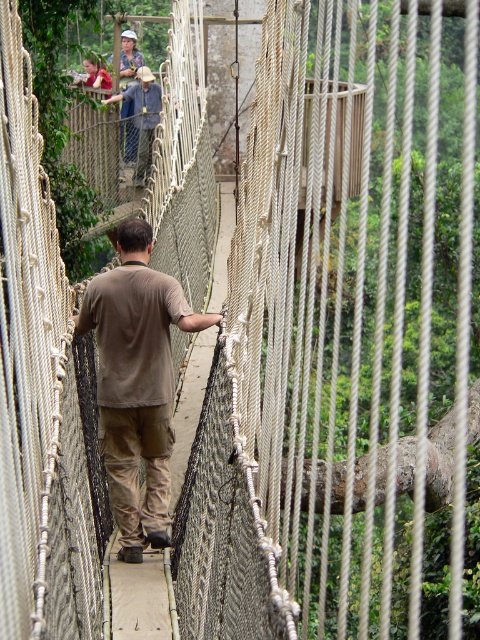
You are standing on the rope bridge depicted in the scene and notice a point marked at coordinates (143, 116). What object is located at that point?

The point at coordinates (143, 116) indicates the location of the denim jacket at upper center.

You are a hiker on the rope bridge and notice two shirts hanging from the bridge. The brown cotton shirt at center and the matte khaki shirt at upper center. Which shirt is closer to the ground?

The brown cotton shirt at center is closer to the ground because it is positioned under the matte khaki shirt at upper center.

You are a hiker preparing to cross the rope bridge. You notice a brown cotton shirt at center and a denim jacket at upper center. Which item of clothing is closer to the ground?

The brown cotton shirt at center is shorter than the denim jacket at upper center, so the brown cotton shirt at center is closer to the ground.